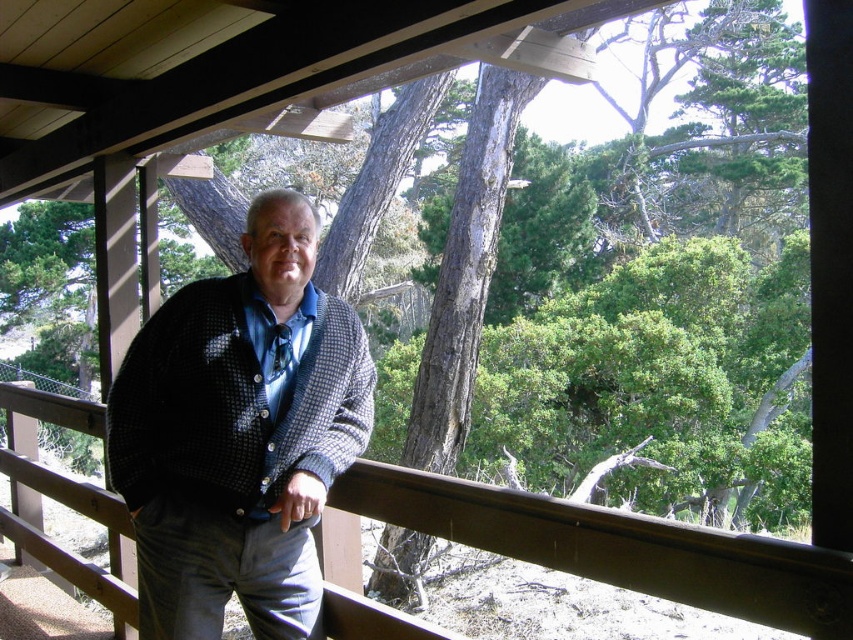
You are on the deck and want to walk from point (720, 570) to point (271, 208). Since you can only move forward, will you be facing away from the forest when you reach your destination?

Point (271, 208) is behind point (720, 570). When moving from point (720, 570) to point (271, 208), you would be facing away from the forest, so yes, you will be facing away from the forest when you reach your destination.

You are a photographer trying to capture the man in the knitted sweater at center and the brown wooden rail at center. Which object should you focus on first if you want to ensure both are in sharp focus?

You should focus on the knitted sweater at center first because it is closer to the viewer than the brown wooden rail at center, so focusing on the closer object will help both be in focus.